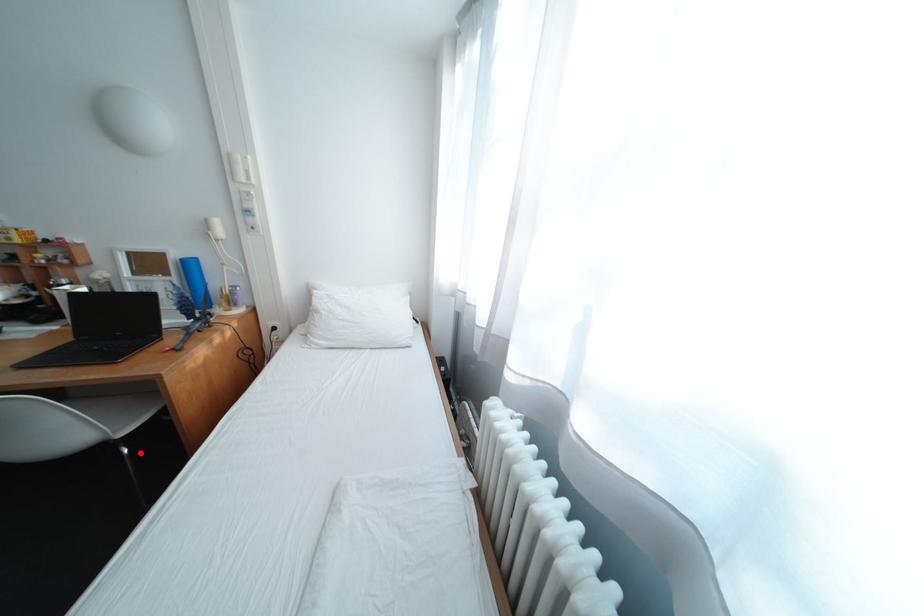
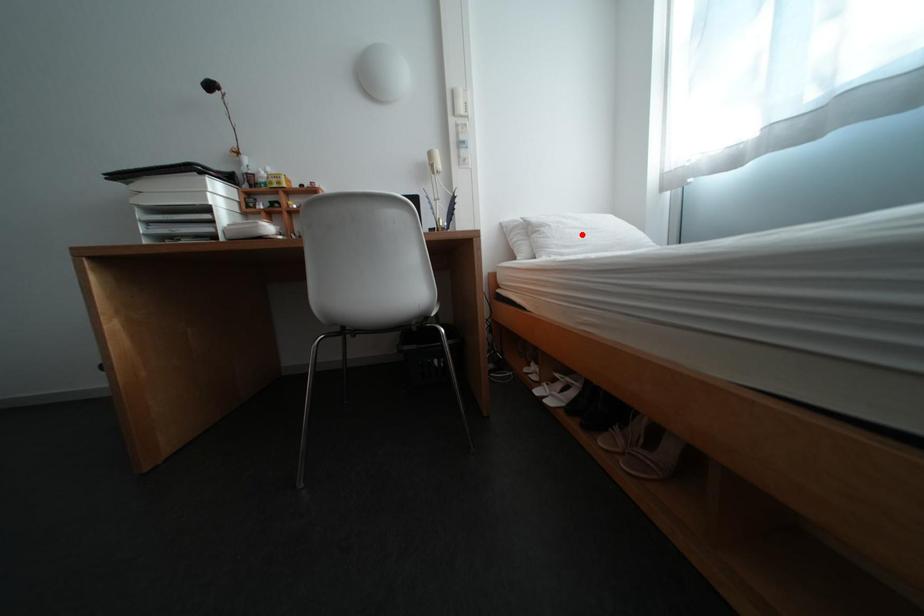
I am providing you with two images of the same scene from different viewpoints. A red point is marked on the first image and another point is marked on the second image. Is the red point in image1 aligned with the point shown in image2?

No